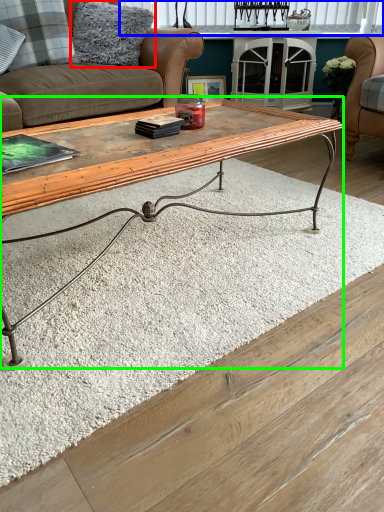
Question: Which object is the farthest from pillow (highlighted by a red box)? Choose among these: window (highlighted by a blue box) or coffee table (highlighted by a green box).

Choices:
 (A) window
 (B) coffee table

Answer: (A)